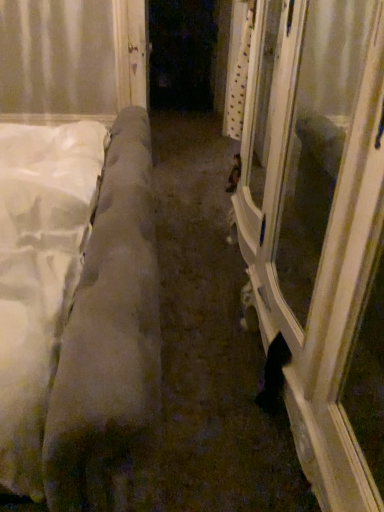
I want to click on white glossy door at center, so click(x=320, y=255).

In order to click on white glossy door at center in this screenshot , I will do `click(138, 52)`.

The image size is (384, 512). In order to click on white soft mattress at left in this screenshot , I will do `click(109, 339)`.

In order to face white soft mattress at left, should I rotate leftwards or rightwards?

A 21.939 degree turn to the left will do.

Where is `white glossy door at center`? white glossy door at center is located at coordinates (320, 255).

From the image's perspective, is white glossy door at center positioned above or below white glossy door at center?

white glossy door at center is above white glossy door at center.

From a real-world perspective, who is located lower, white glossy door at center or white glossy door at center?

white glossy door at center.

Choose the correct answer: Is white glossy door at center inside white glossy door at center or outside it?

white glossy door at center lies outside white glossy door at center.

Locate an element on the screen. This screenshot has height=512, width=384. door that appears above the white glossy door at center (from the image's perspective) is located at coordinates (138, 52).

Who is bigger, white glossy door at center or white glossy door at center?

With larger size is white glossy door at center.

From a real-world perspective, relative to white glossy door at center, is white glossy door at center vertically above or below?

From a real-world perspective, white glossy door at center is physically below white glossy door at center.

Considering the sizes of white glossy door at center and white glossy door at center in the image, is white glossy door at center wider or thinner than white glossy door at center?

white glossy door at center is wider than white glossy door at center.

Identify the location of window frame below the white glossy door at center (from a real-world perspective). The width and height of the screenshot is (384, 512). (320, 255).

Can you tell me how much white soft mattress at left and white glossy door at center differ in facing direction?

0.948 degrees.

From a real-world perspective, is white soft mattress at left over white glossy door at center?

Indeed, from a real-world perspective, white soft mattress at left stands above white glossy door at center.

Considering the positions of objects white soft mattress at left and white glossy door at center in the image provided, who is more to the right, white soft mattress at left or white glossy door at center?

white glossy door at center.

Is the position of white soft mattress at left less distant than that of white glossy door at center?

Yes, white soft mattress at left is closer to the camera.

Can we say white glossy door at center lies outside white soft mattress at left?

Absolutely, white glossy door at center is external to white soft mattress at left.

From the image's perspective, is white glossy door at center under white soft mattress at left?

Actually, white glossy door at center appears above white soft mattress at left in the image.

Locate an element on the screen. mattress in front of the white glossy door at center is located at coordinates 109,339.

Is white glossy door at center shorter than white soft mattress at left?

Yes.

Is white soft mattress at left taller or shorter than white glossy door at center?

white soft mattress at left is taller than white glossy door at center.

From a real-world perspective, is white soft mattress at left physically above white glossy door at center?

No, from a real-world perspective, white soft mattress at left is not above white glossy door at center.

Is white soft mattress at left further to camera compared to white glossy door at center?

That is False.

Is white soft mattress at left facing towards white glossy door at center?

No, white soft mattress at left is not oriented towards white glossy door at center.

Measure the distance between white glossy door at center and white soft mattress at left.

A distance of 19.84 inches exists between white glossy door at center and white soft mattress at left.

Is white glossy door at center not close to white soft mattress at left?

No.

Can you tell me how much white glossy door at center and white soft mattress at left differ in facing direction?

white glossy door at center and white soft mattress at left are facing 0.948 degrees away from each other.

Is white glossy door at center turned away from white soft mattress at left?

No, white glossy door at center is not facing away from white soft mattress at left.

The width and height of the screenshot is (384, 512). In order to click on window frame in front of the white glossy door at center in this screenshot , I will do `click(320, 255)`.

What are the coordinates of `door above the white glossy door at center (from the image's perspective)` in the screenshot? It's located at (138, 52).

Considering their positions, is white glossy door at center positioned closer to white glossy door at center than white soft mattress at left?

Among the two, white glossy door at center is located nearer to white glossy door at center.

Based on their spatial positions, is white glossy door at center or white soft mattress at left further from white glossy door at center?

white glossy door at center.

Considering their positions, is white soft mattress at left positioned closer to white glossy door at center than white glossy door at center?

white glossy door at center lies closer to white glossy door at center than the other object.

Estimate the real-world distances between objects in this image. Which object is further from white soft mattress at left, white glossy door at center or white glossy door at center?

The object further to white soft mattress at left is white glossy door at center.

From the image, which object appears to be farther from white glossy door at center, white soft mattress at left or white glossy door at center?

Based on the image, white glossy door at center appears to be further to white glossy door at center.

Looking at the image, which one is located closer to white soft mattress at left, white glossy door at center or white glossy door at center?

Based on the image, white glossy door at center appears to be nearer to white soft mattress at left.

The width and height of the screenshot is (384, 512). Find the location of `window frame between white soft mattress at left and white glossy door at center along the z-axis`. window frame between white soft mattress at left and white glossy door at center along the z-axis is located at coordinates (320, 255).